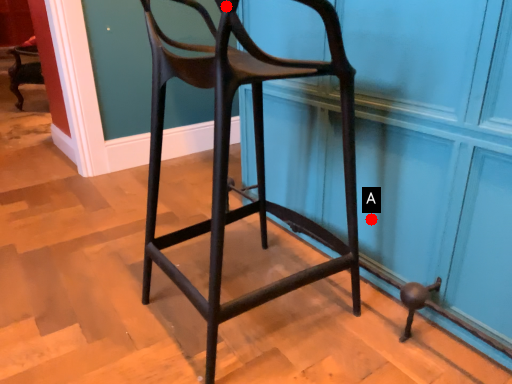
Question: Two points are circled on the image, labeled by A and B beside each circle. Which point is farther to the camera?

Choices:
 (A) A is further
 (B) B is further

Answer: (A)